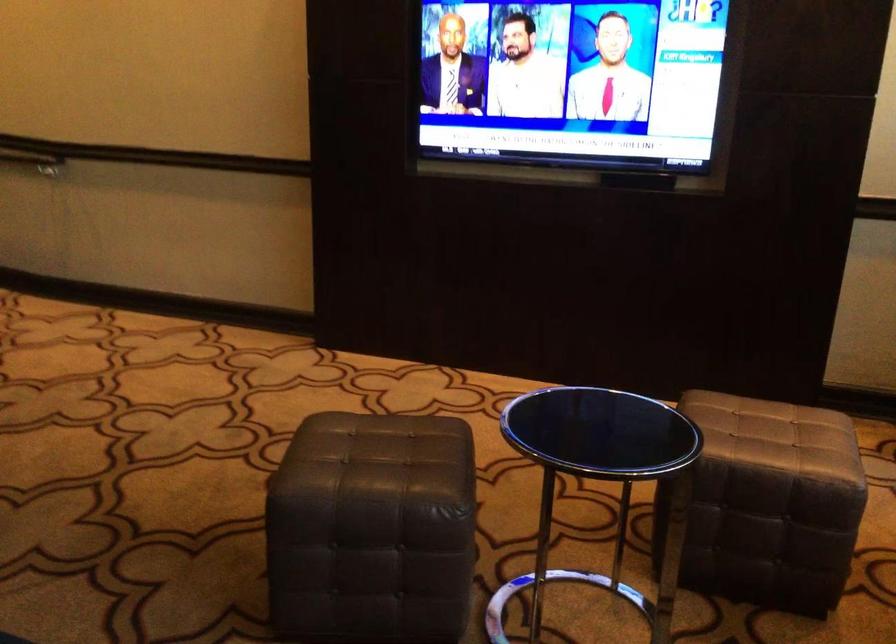
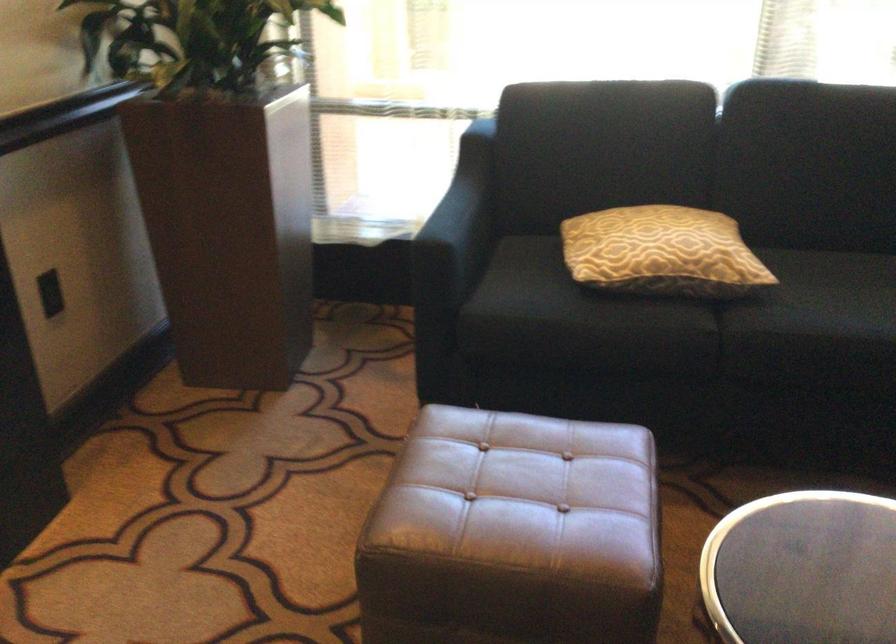
Locate, in the second image, the point that corresponds to pixel 728 433 in the first image.

(522, 495)